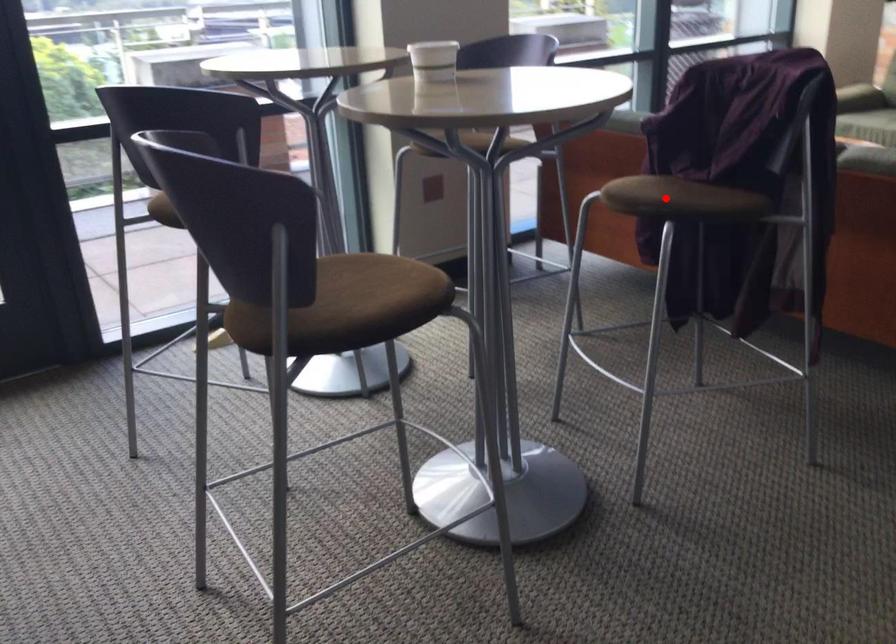
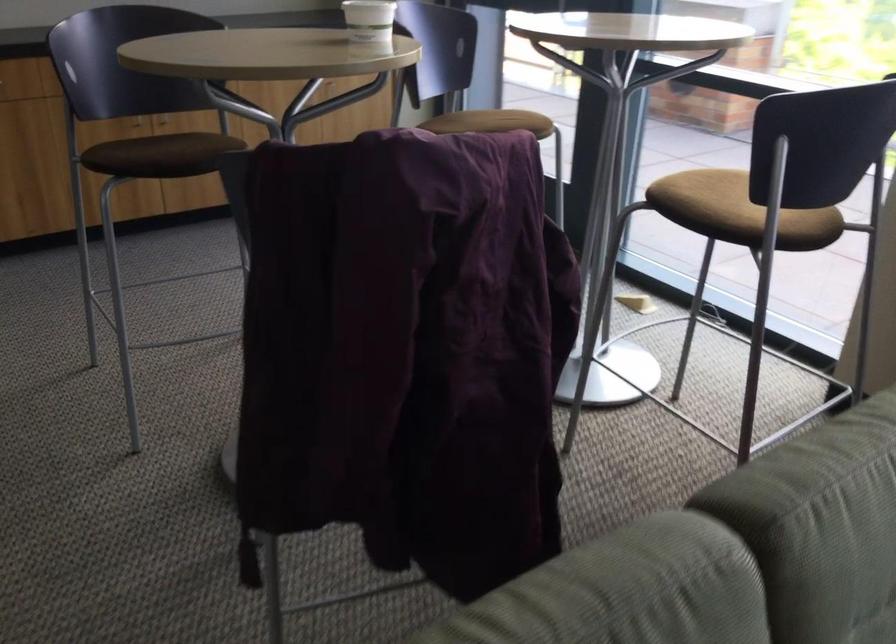
Question: I am providing you with two images of the same scene from different viewpoints. A red point is marked on the first image. Can you still see the location of the red point in image 2?

Choices:
 (A) Yes
 (B) No

Answer: (B)